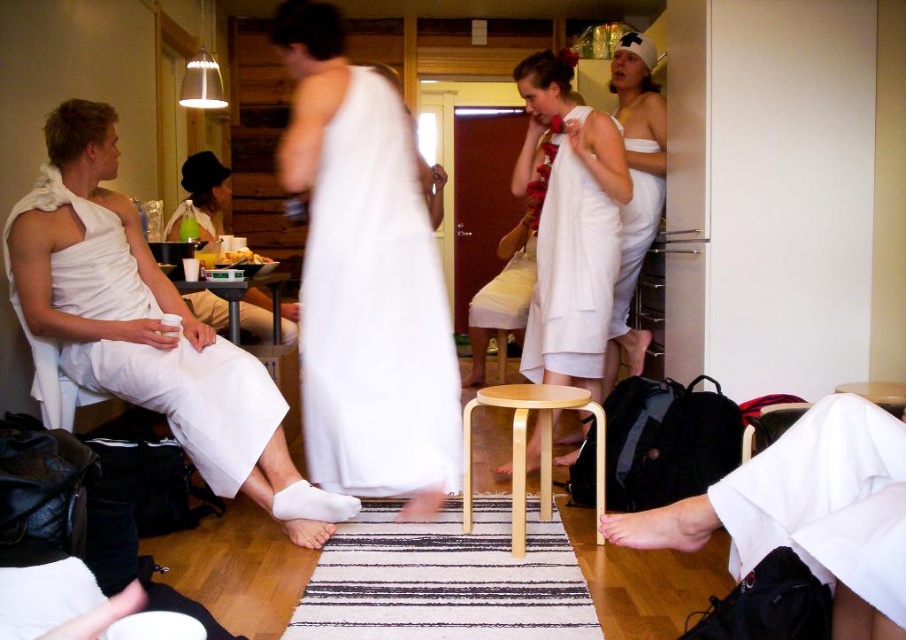
Question: Which of the following is the closest to the observer?

Choices:
 (A) (548, 193)
 (B) (397, 424)
 (C) (294, 314)
 (D) (103, 196)

Answer: (B)

Question: Among these points, which one is farthest from the camera?

Choices:
 (A) (470, 516)
 (B) (542, 220)
 (C) (736, 504)
 (D) (617, 282)

Answer: (D)

Question: Does white cotton towel at center appear on the right side of white cotton towel at upper right?

Choices:
 (A) no
 (B) yes

Answer: (A)

Question: In this image, where is white cotton robe at lower right located relative to white matte dress at center?

Choices:
 (A) left
 (B) right

Answer: (B)

Question: Does matte black mug at center have a larger size compared to white cotton towel at upper right?

Choices:
 (A) yes
 (B) no

Answer: (A)

Question: Which point is closer to the camera?

Choices:
 (A) matte black mug at center
 (B) white cotton robe at lower right
 (C) white cloth at left

Answer: (B)